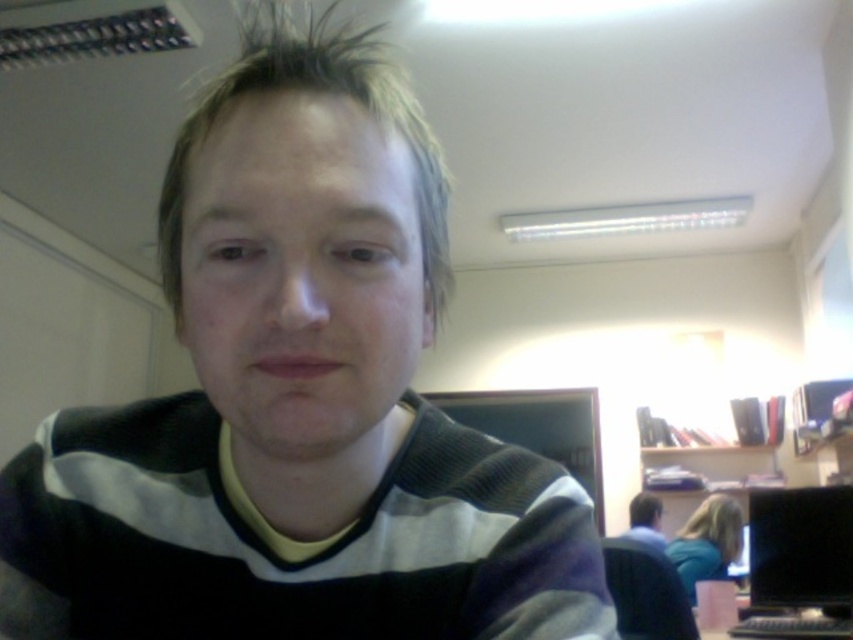
Can you confirm if black striped sweater at center is wider than matte black sweater at center?

Indeed, black striped sweater at center has a greater width compared to matte black sweater at center.

Describe the element at coordinates (297, 403) in the screenshot. I see `black striped sweater at center` at that location.

This screenshot has width=853, height=640. Identify the location of black striped sweater at center. (297, 403).

Measure the distance between point (836, 541) and camera.

Point (836, 541) and camera are 8.11 feet apart from each other.

From the picture: Can you confirm if black glossy monitor at right is positioned to the right of matte black sweater at center?

Indeed, black glossy monitor at right is positioned on the right side of matte black sweater at center.

Is point (813, 515) positioned after point (637, 536)?

No.

The width and height of the screenshot is (853, 640). I want to click on black glossy monitor at right, so click(801, 548).

Who is positioned more to the right, black striped sweater at center or black glossy monitor at right?

From the viewer's perspective, black glossy monitor at right appears more on the right side.

Who is more distant from viewer, (82, 547) or (763, 508)?

Point (763, 508)

Does point (492, 490) come farther from viewer compared to point (808, 534)?

No, (492, 490) is in front of (808, 534).

Identify the location of black striped sweater at center. The width and height of the screenshot is (853, 640). (297, 403).